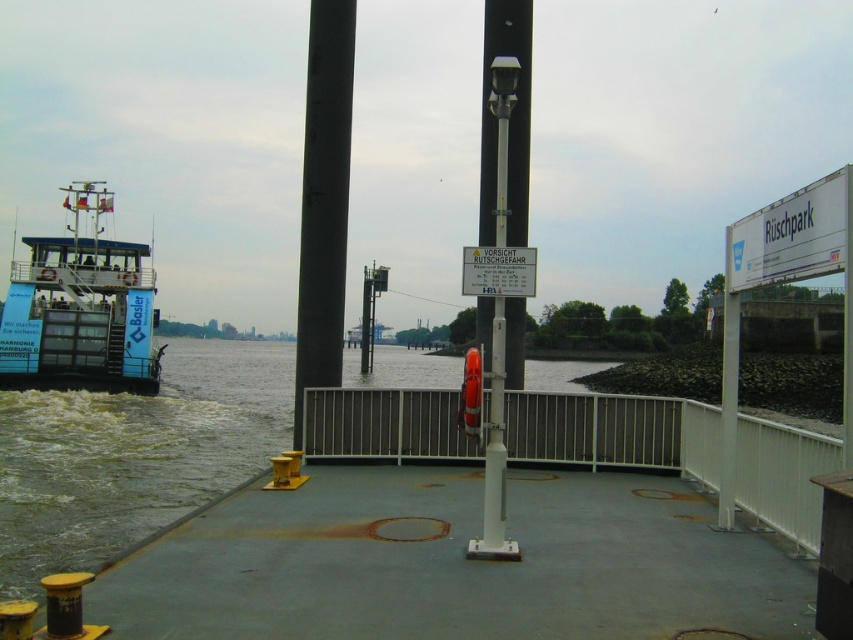
Question: Is blue painted steel ferry at left to the left of white plastic pole at center from the viewer's perspective?

Choices:
 (A) no
 (B) yes

Answer: (B)

Question: Which object appears closest to the camera in this image?

Choices:
 (A) white plastic sign at right
 (B) white plastic sign at center
 (C) white plastic pole at center

Answer: (A)

Question: Is white plastic pole at center below black smooth pole at center?

Choices:
 (A) yes
 (B) no

Answer: (B)

Question: Is white plastic pole at center bigger than white plastic sign at right?

Choices:
 (A) no
 (B) yes

Answer: (A)

Question: Which point is farther from the camera taking this photo?

Choices:
 (A) (518, 24)
 (B) (791, 276)
 (C) (85, 406)

Answer: (C)

Question: Which point is closer to the camera?

Choices:
 (A) white plastic sign at right
 (B) clear water at dock right
 (C) white plastic pole at center

Answer: (A)